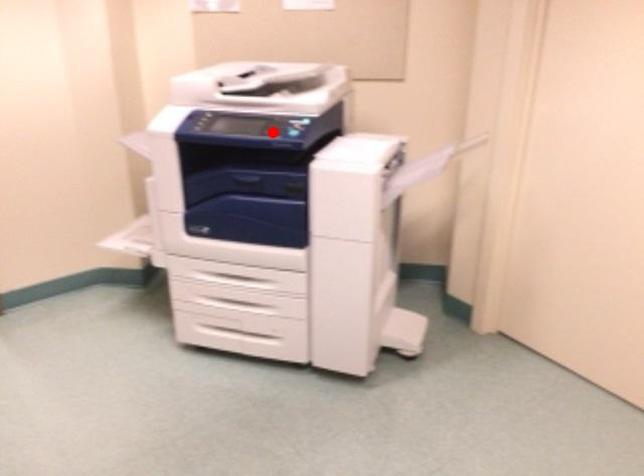
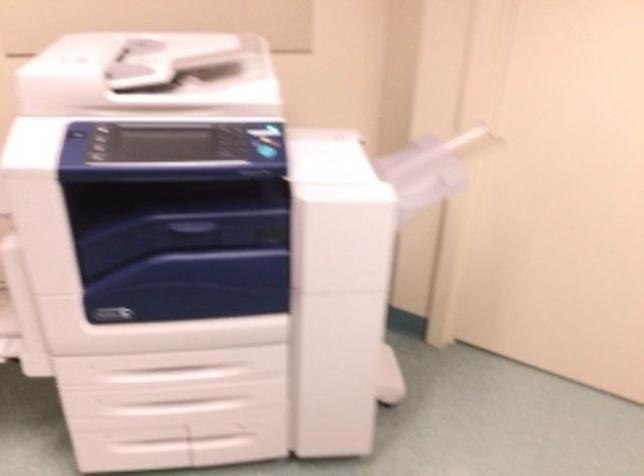
Find the pixel in the second image that matches the highlighted location in the first image.

(232, 150)